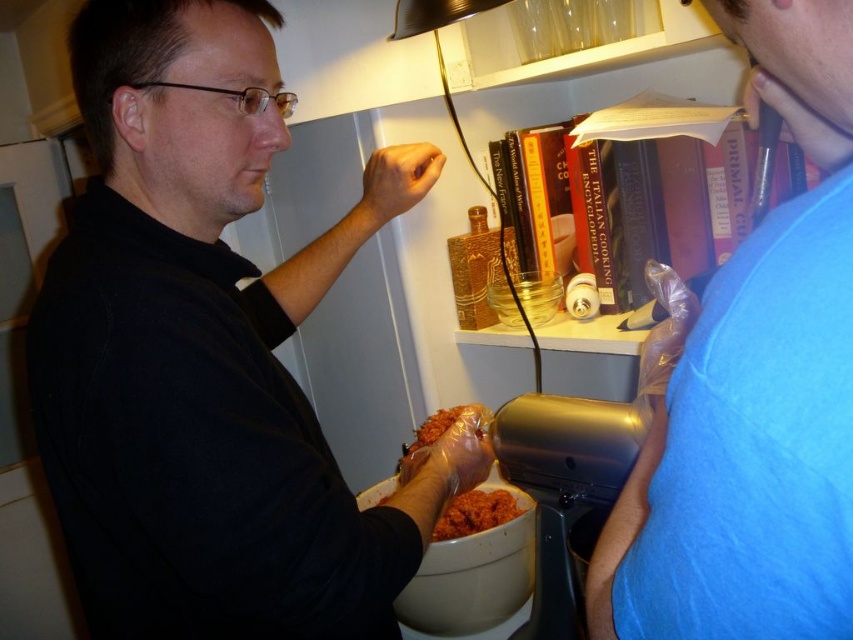
Does point (759, 365) come behind point (434, 419)?

No, (759, 365) is in front of (434, 419).

You are a GUI agent. You are given a task and a screenshot of the screen. Output one action in this format:
    pyautogui.click(x=<x>, y=<y>)
    Task: Click on the blue fabric shirt at upper right
    The width and height of the screenshot is (853, 640).
    Given the screenshot: What is the action you would take?
    click(x=755, y=392)

Does point (792, 77) come behind point (444, 518)?

No, (792, 77) is in front of (444, 518).

Does blue fabric shirt at upper right have a smaller size compared to reddish-brown paste at center?

Actually, blue fabric shirt at upper right might be larger than reddish-brown paste at center.

Measure the distance between blue fabric shirt at upper right and camera.

21.84 centimeters

The width and height of the screenshot is (853, 640). I want to click on blue fabric shirt at upper right, so click(755, 392).

Is reddish-brown paste at center bigger than shiny plastic food at center?

Indeed, reddish-brown paste at center has a larger size compared to shiny plastic food at center.

Who is more distant from viewer, (490, 516) or (445, 428)?

The point (445, 428) is more distant.

Locate an element on the screen. reddish-brown paste at center is located at coordinates (474, 513).